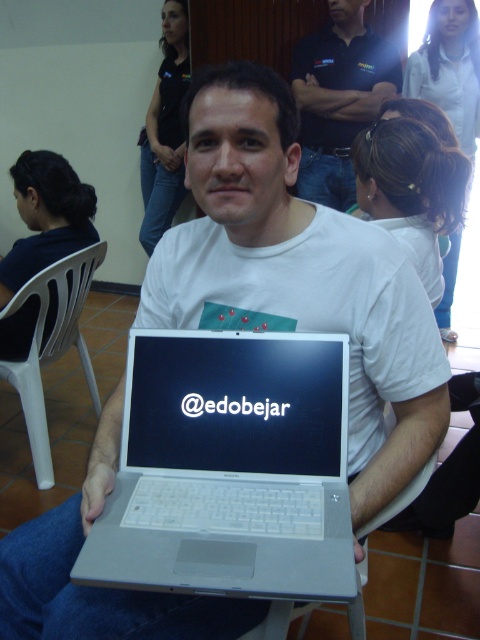
You are a person who is 5 feet tall. You are standing in the scene and want to sit down on the white plastic chair at lower center. Can you reach the matte white hair at upper center while sitting on the chair?

The distance between matte white hair at upper center and white plastic chair at lower center is 7.61 feet. Since you are 5 feet tall, you cannot reach the matte white hair at upper center while sitting on the chair because the distance is greater than your height.

You are a photographer in a studio setting and need to arrange two shirts, the dark blue shirt at upper center and the black shirt at upper center, on a display rack. Which shirt should be placed higher on the rack to ensure they are arranged from tallest to shortest?

The black shirt at upper center should be placed higher on the rack since it is taller than the dark blue shirt at upper center.